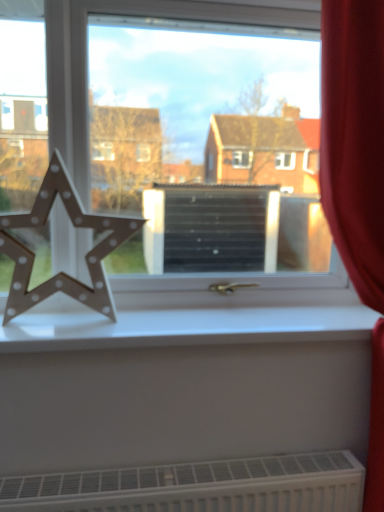
At what (x,y) coordinates should I click in order to perform the action: click on free point above white matte window sill at center (from a real-world perspective). Please return your answer as a coordinate pair (x, y). This screenshot has height=512, width=384. Looking at the image, I should click on (193, 312).